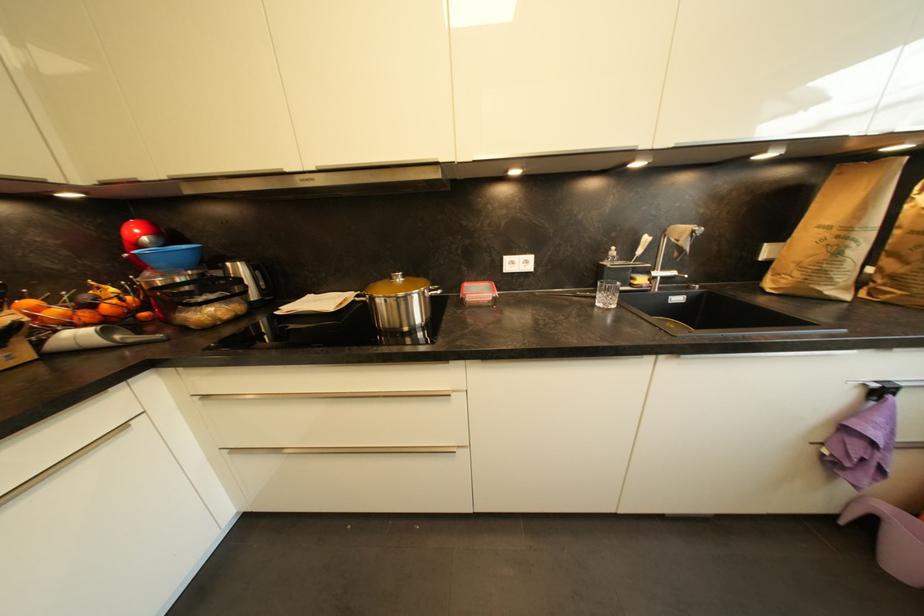
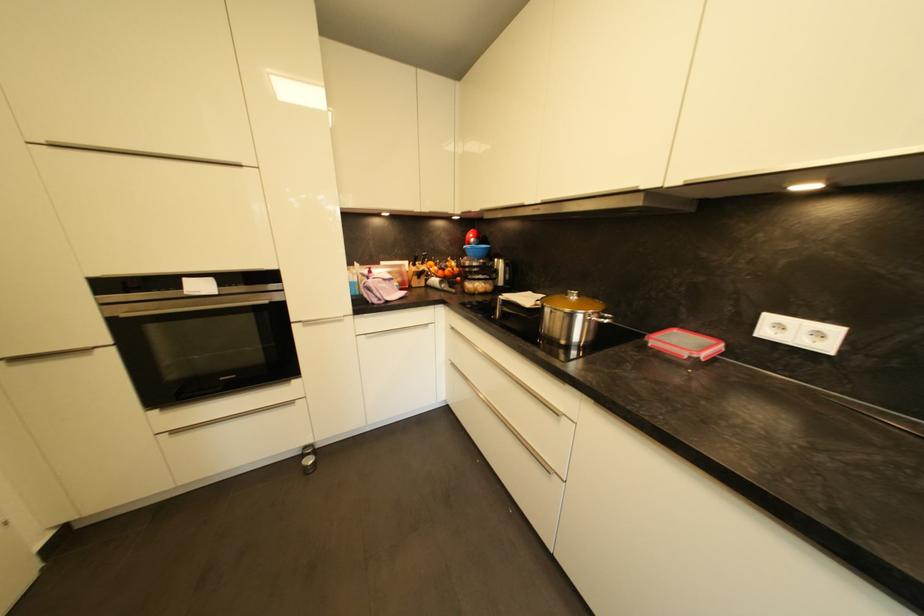
Question: How did the camera likely rotate?

Choices:
 (A) Left
 (B) Right
 (C) Up
 (D) Down

Answer: (A)